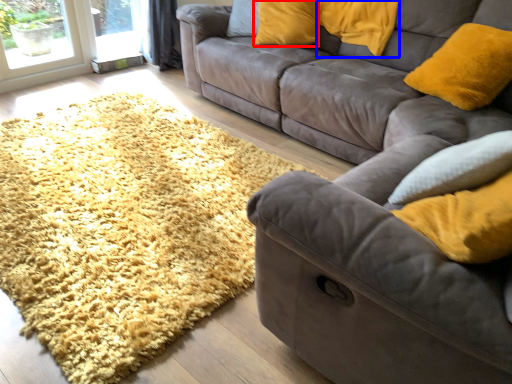
Question: Which point is closer to the camera, pillow (highlighted by a red box) or pillow (highlighted by a blue box)?

Choices:
 (A) pillow
 (B) pillow

Answer: (B)